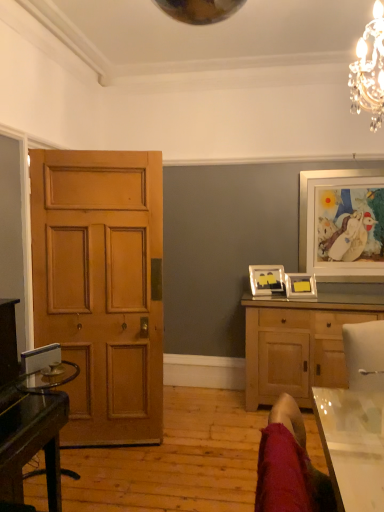
Question: From the image's perspective, would you say white glossy picture frame at upper right, placed as the 1th picture frame when sorted from right to left, is shown under velvet red swivel chair at lower right?

Choices:
 (A) no
 (B) yes

Answer: (A)

Question: From a real-world perspective, is white glossy picture frame at upper right, placed as the 1th picture frame when sorted from right to left, over velvet red swivel chair at lower right?

Choices:
 (A) yes
 (B) no

Answer: (A)

Question: Is white glossy picture frame at upper right, placed as the 1th picture frame when sorted from right to left, thinner than velvet red swivel chair at lower right?

Choices:
 (A) no
 (B) yes

Answer: (B)

Question: Is white glossy picture frame at upper right, placed as the 1th picture frame when sorted from right to left, completely or partially outside of velvet red swivel chair at lower right?

Choices:
 (A) no
 (B) yes

Answer: (B)

Question: Considering the relative positions of white glossy picture frame at upper right, placed as the 1th picture frame when sorted from right to left, and velvet red swivel chair at lower right in the image provided, is white glossy picture frame at upper right, placed as the 1th picture frame when sorted from right to left, to the left of velvet red swivel chair at lower right from the viewer's perspective?

Choices:
 (A) no
 (B) yes

Answer: (A)

Question: From the image's perspective, is glass transparent desk at left located above or below white glossy picture frame at upper right, the third picture frame viewed from the left?

Choices:
 (A) below
 (B) above

Answer: (A)

Question: In terms of height, does glass transparent desk at left look taller or shorter compared to white glossy picture frame at upper right, the third picture frame viewed from the left?

Choices:
 (A) short
 (B) tall

Answer: (A)

Question: Looking at their shapes, would you say glass transparent desk at left is wider or thinner than white glossy picture frame at upper right, the third picture frame viewed from the left?

Choices:
 (A) wide
 (B) thin

Answer: (A)

Question: From a real-world perspective, relative to white glossy picture frame at upper right, the third picture frame viewed from the left, is glass transparent desk at left vertically above or below?

Choices:
 (A) below
 (B) above

Answer: (A)

Question: From a real-world perspective, relative to wooden cabinet at right, is transparent glass table at lower right vertically above or below?

Choices:
 (A) below
 (B) above

Answer: (B)

Question: From the image's perspective, is transparent glass table at lower right located above or below wooden cabinet at right?

Choices:
 (A) above
 (B) below

Answer: (A)

Question: In terms of width, does transparent glass table at lower right look wider or thinner when compared to wooden cabinet at right?

Choices:
 (A) wide
 (B) thin

Answer: (B)

Question: Does point (327, 411) appear closer or farther from the camera than point (253, 334)?

Choices:
 (A) farther
 (B) closer

Answer: (B)

Question: Is velvet red swivel chair at lower right spatially inside glass transparent desk at left, or outside of it?

Choices:
 (A) inside
 (B) outside

Answer: (B)

Question: Considering the positions of velvet red swivel chair at lower right and glass transparent desk at left in the image, is velvet red swivel chair at lower right taller or shorter than glass transparent desk at left?

Choices:
 (A) tall
 (B) short

Answer: (B)